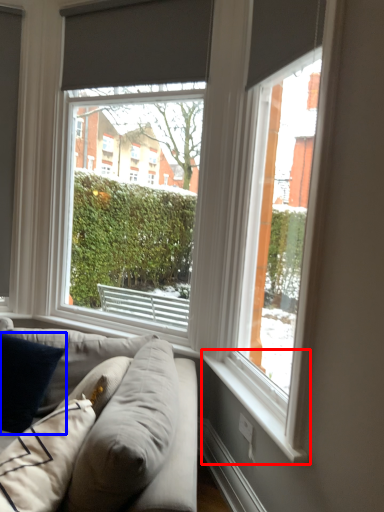
Question: Which of the following is the closest to the observer, window sill (highlighted by a red box) or pillow (highlighted by a blue box)?

Choices:
 (A) window sill
 (B) pillow

Answer: (A)